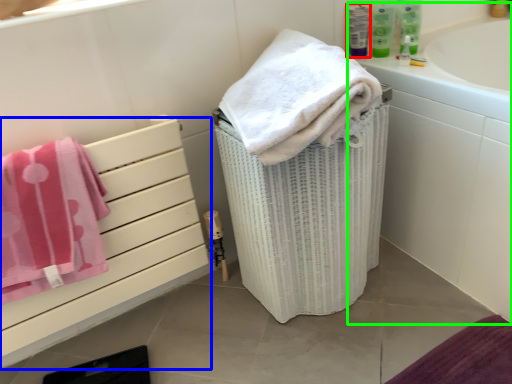
Question: Which object is the closest to the mouthwash (highlighted by a red box)? Choose among these: drawer (highlighted by a blue box) or bath (highlighted by a green box).

Choices:
 (A) drawer
 (B) bath

Answer: (B)